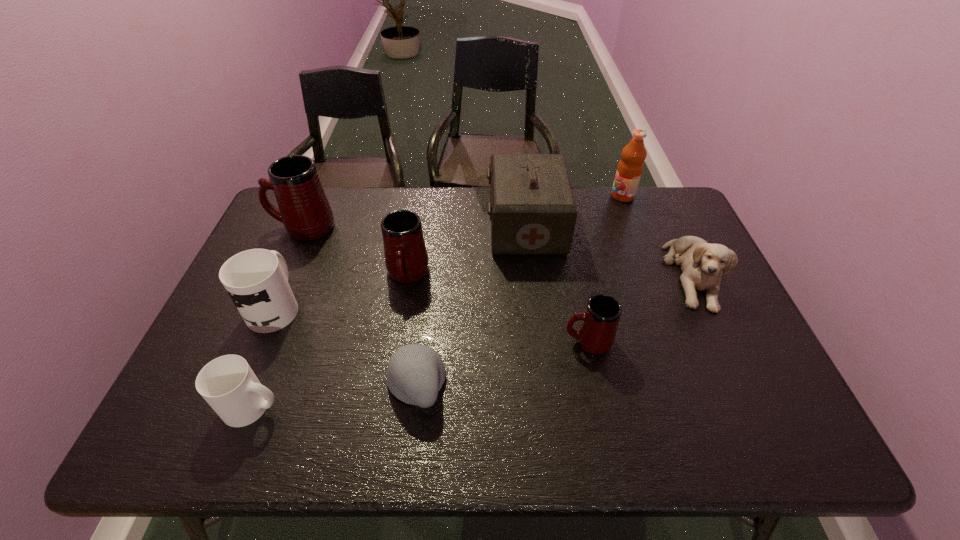
In order to click on free spot between the nearer white mug and the second biggest red mug in this screenshot , I will do `click(330, 340)`.

This screenshot has width=960, height=540. Identify the location of free space between the white puppy and the eighth object from left to right. point(658,235).

Point out which object is positioned as the nearest to the second red mug from right to left. Please provide its 2D coordinates. Your answer should be formatted as a tuple, i.e. [(x, y)], where the tuple contains the x and y coordinates of a point satisfying the conditions above.

[(532, 209)]

Identify which object is the third nearest to the nearest red mug. Please provide its 2D coordinates. Your answer should be formatted as a tuple, i.e. [(x, y)], where the tuple contains the x and y coordinates of a point satisfying the conditions above.

[(415, 374)]

Where is `the closest mug to the nearest red mug`? the closest mug to the nearest red mug is located at coordinates (406, 259).

Identify the location of mug that stands as the fourth closest to the leftmost red mug. (596, 333).

Point out which red mug is positioned as the third nearest to the shortest object. Please provide its 2D coordinates. Your answer should be formatted as a tuple, i.e. [(x, y)], where the tuple contains the x and y coordinates of a point satisfying the conditions above.

[(304, 209)]

You are a GUI agent. You are given a task and a screenshot of the screen. Output one action in this format:
    pyautogui.click(x=<x>, y=<y>)
    Task: Click on the red mug that is the closest to the shortest object
    
    Given the screenshot: What is the action you would take?
    pyautogui.click(x=406, y=259)

Identify the location of free space that satisfies the following two spatial constraints: 1. on the front-facing side of the rightmost object; 2. on the handle side of the smaller white mug. (754, 406).